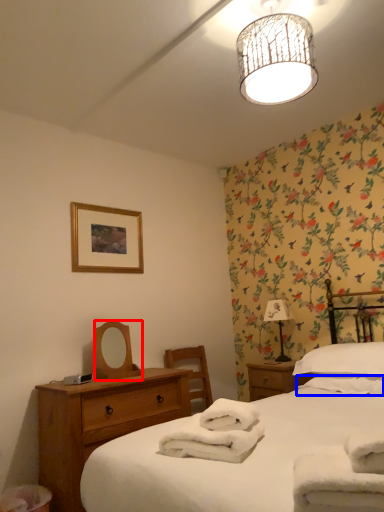
Question: Which point is closer to the camera, mirror (highlighted by a red box) or bath towel (highlighted by a blue box)?

Choices:
 (A) mirror
 (B) bath towel

Answer: (B)